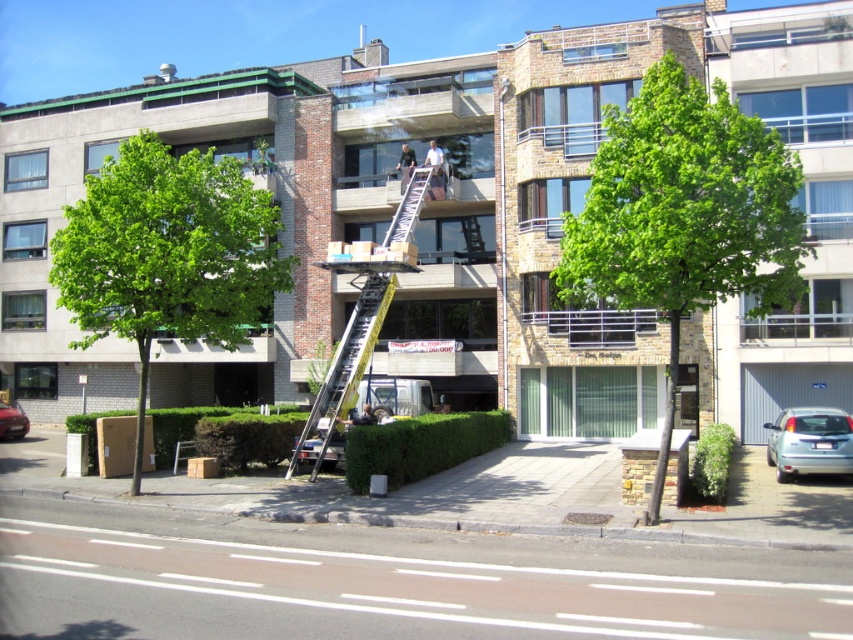
You are a city planner reviewing this area. You need to install a new streetlight between the green leafy tree at center and the green leafy tree at left. Based on their positions, which tree is closer to the streetlight pole if the pole is placed exactly halfway between them?

The green leafy tree at left is closer to the streetlight pole because the green leafy tree at center is located above it, meaning the tree at left is positioned lower and thus closer to the ground level where the pole would be installed.

You are a delivery driver who needs to park your shiny red car at lower left in a parking spot that is 100 feet away from the camera. Can you safely park there?

The shiny red car at lower left and camera are 98.54 feet apart, so yes, the driver can safely park there since the distance is within the required 100 feet.